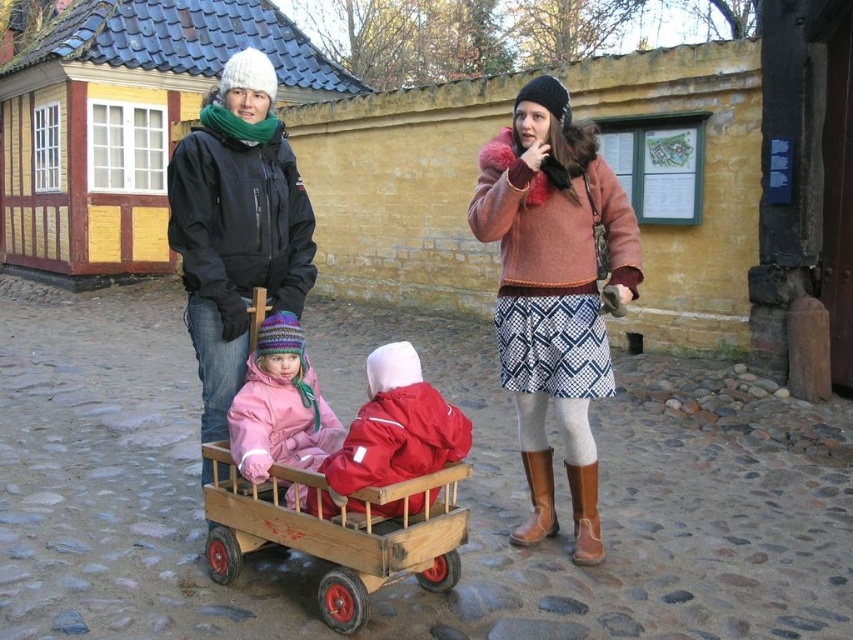
Between point (439, 531) and point (428, 429), which one is positioned in front?

Positioned in front is point (428, 429).

Is wooden wagon at center positioned before red matte jacket at center?

That is True.

Locate an element on the screen. Image resolution: width=853 pixels, height=640 pixels. wooden wagon at center is located at coordinates (338, 532).

Is rustic wool sweater at center bigger than matte pink snowsuit at center?

Yes.

Is point (523, 192) positioned in front of point (300, 445)?

Yes, it is.

This screenshot has width=853, height=640. What do you see at coordinates (555, 291) in the screenshot? I see `rustic wool sweater at center` at bounding box center [555, 291].

At what (x,y) coordinates should I click in order to perform the action: click on rustic wool sweater at center. Please return your answer as a coordinate pair (x, y). Looking at the image, I should click on (555, 291).

Does rustic wool sweater at center have a greater height compared to red matte jacket at center?

Indeed, rustic wool sweater at center has a greater height compared to red matte jacket at center.

Which is in front, point (593, 499) or point (424, 403)?

Point (424, 403) is more forward.

The width and height of the screenshot is (853, 640). Find the location of `rustic wool sweater at center`. rustic wool sweater at center is located at coordinates tap(555, 291).

This screenshot has height=640, width=853. I want to click on rustic wool sweater at center, so click(x=555, y=291).